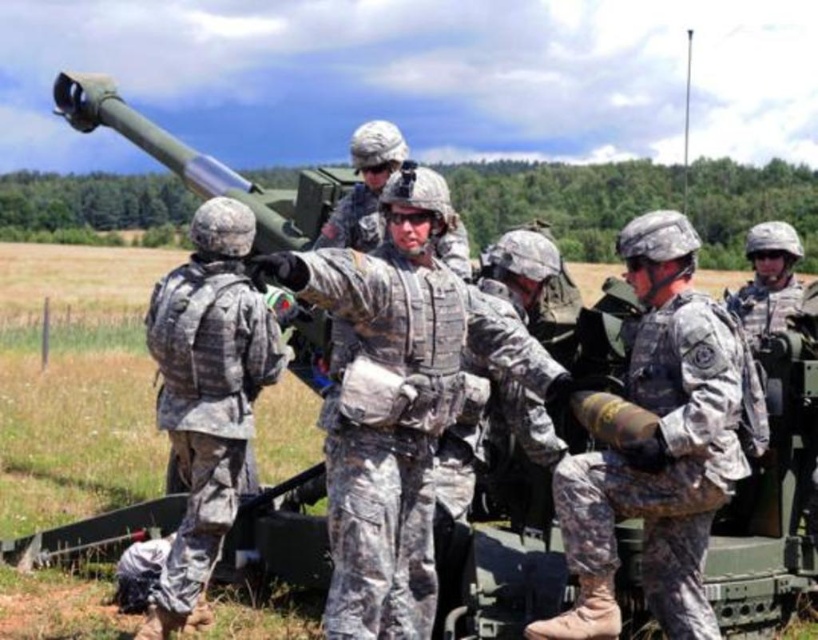
Question: Which of the following is the farthest from the observer?

Choices:
 (A) camouflage uniform at center
 (B) camouflage fabric bomb at center
 (C) camouflage fabric uniform at center

Answer: (C)

Question: Observing the image, what is the correct spatial positioning of camouflage uniform at center in reference to camouflage fabric uniform at center?

Choices:
 (A) right
 (B) left

Answer: (A)

Question: In this image, where is camouflage uniform at center located relative to camouflage fabric bomb at center?

Choices:
 (A) above
 (B) below

Answer: (A)

Question: Is camouflage fabric bomb at center bigger than camouflage fabric uniform at center?

Choices:
 (A) yes
 (B) no

Answer: (A)

Question: Which is nearer to the camouflage uniform at center?

Choices:
 (A) camouflage fabric bomb at center
 (B) camouflage fabric uniform at center

Answer: (A)

Question: Which point is closer to the camera?

Choices:
 (A) [216, 257]
 (B) [697, 384]

Answer: (B)